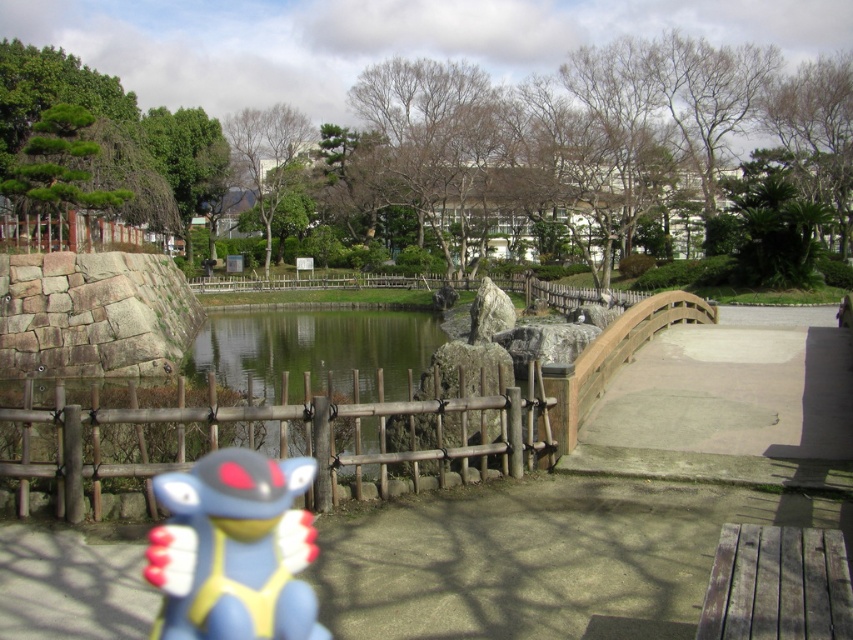
Who is positioned more to the right, wooden fence at center or green reflective water at center?

wooden fence at center is more to the right.

Is wooden fence at center shorter than green reflective water at center?

Correct, wooden fence at center is not as tall as green reflective water at center.

Who is more distant from viewer, (x=532, y=433) or (x=383, y=328)?

The point (x=383, y=328) is behind.

This screenshot has height=640, width=853. In order to click on wooden fence at center in this screenshot , I will do pyautogui.click(x=277, y=436).

Who is positioned more to the right, blue rubber toy at lower left or green reflective water at center?

blue rubber toy at lower left is more to the right.

Who is more distant from viewer, [223,556] or [190,372]?

The point [190,372] is behind.

The image size is (853, 640). What are the coordinates of `blue rubber toy at lower left` in the screenshot? It's located at (234, 548).

I want to click on blue rubber toy at lower left, so click(234, 548).

Can you confirm if wooden fence at center is shorter than blue rubber toy at lower left?

No, wooden fence at center is not shorter than blue rubber toy at lower left.

Consider the image. Is wooden fence at center smaller than blue rubber toy at lower left?

Incorrect, wooden fence at center is not smaller in size than blue rubber toy at lower left.

Locate an element on the screen. The height and width of the screenshot is (640, 853). wooden fence at center is located at coordinates (277, 436).